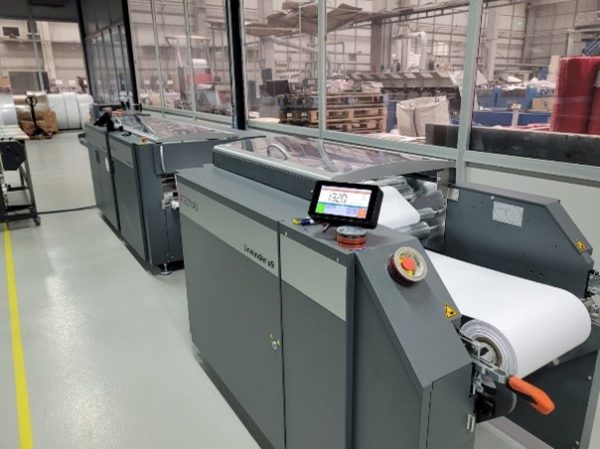
You are a GUI agent. You are given a task and a screenshot of the screen. Output one action in this format:
    pyautogui.click(x=<x>, y=<y>)
    Task: Click on the computer screen
    This screenshot has width=600, height=449.
    Given the screenshot: What is the action you would take?
    pyautogui.click(x=345, y=209)